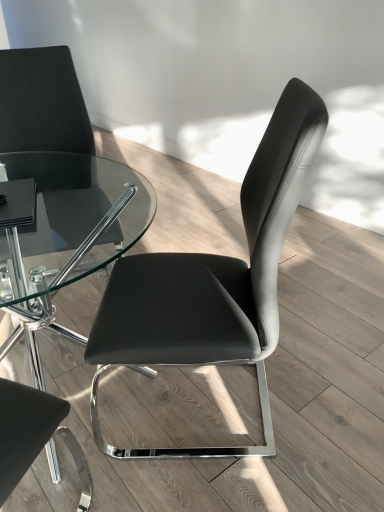
At what (x,y) coordinates should I click in order to perform the action: click on vacant space underneath black leather chair at center, which is the 2th chair from left to right (from a real-world perspective). Please return your answer as a coordinate pair (x, y). This screenshot has height=512, width=384. Looking at the image, I should click on (227, 400).